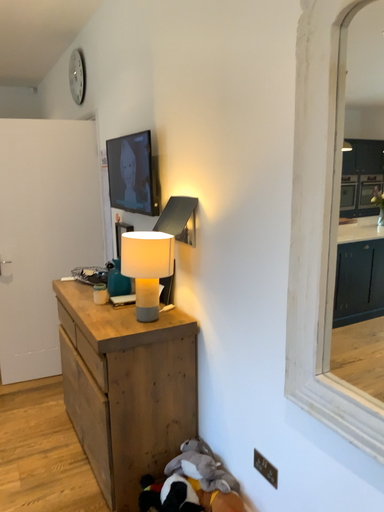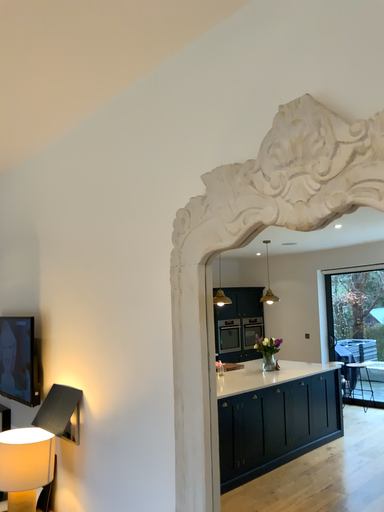
Question: How did the camera likely rotate when shooting the video?

Choices:
 (A) rotated left
 (B) rotated right

Answer: (B)